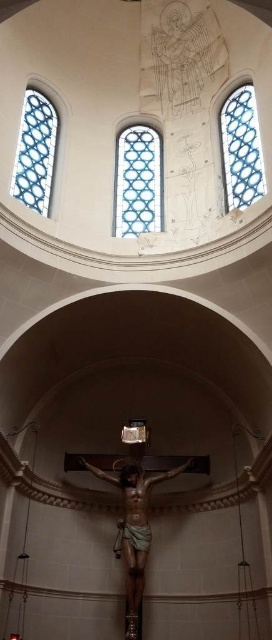
You are standing in the church and want to take a photo of the blue stained glass at upper right and the blue stained glass at left. Which one will appear larger in your photo?

The blue stained glass at upper right will appear larger in the photo because it is closer to the viewer than the blue stained glass at left.

You are standing in the church and want to take a photo of the crucifixion scene. The point you need to focus on is at point (257, 132). Given that the distance between this point and your camera is 66.65 meters, is this point within the typical focusing range of a standard camera lens?

The distance between point (257, 132) and the camera is 66.65 meters. Standard camera lenses typically have a focusing range that can handle distances up to around 100 meters or more, so this point is within the typical focusing range of a standard camera lens.